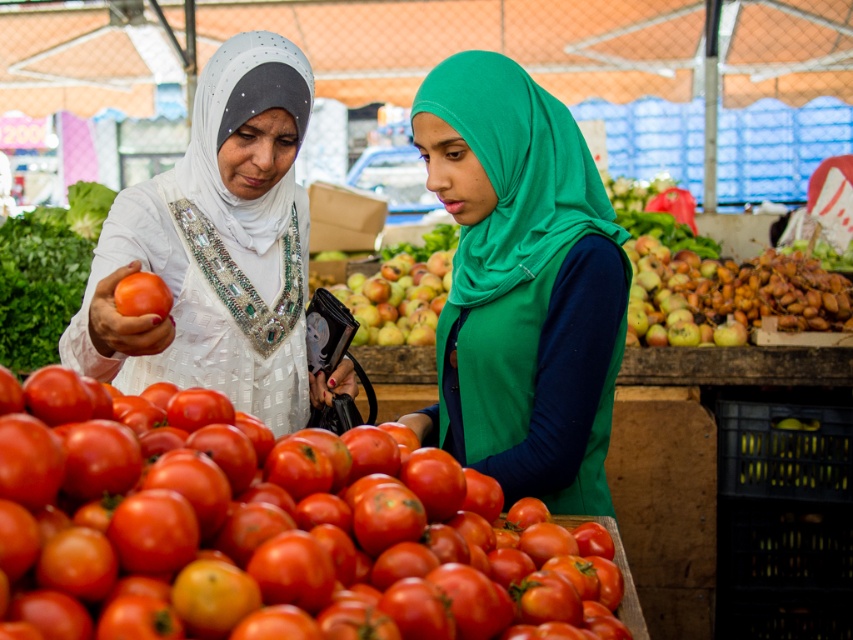
Question: Is brown textured nuts at right further to the viewer compared to smooth green lettuce at upper left?

Choices:
 (A) yes
 (B) no

Answer: (A)

Question: Which object appears farthest from the camera in this image?

Choices:
 (A) shiny green apple at center
 (B) white satin hijab at upper left
 (C) brown textured nuts at right

Answer: (A)

Question: Which point is closer to the camera taking this photo?

Choices:
 (A) (122, 625)
 (B) (151, 292)
 (C) (585, 224)

Answer: (A)

Question: Can you confirm if brown textured nuts at right is thinner than white satin hijab at upper left?

Choices:
 (A) yes
 (B) no

Answer: (B)

Question: Based on their relative distances, which object is nearer to the smooth green lettuce at upper left?

Choices:
 (A) shiny red tomato at center
 (B) green matte hijab at center

Answer: (B)

Question: Is shiny red tomato at center smaller than smooth green lettuce at upper left?

Choices:
 (A) no
 (B) yes

Answer: (B)